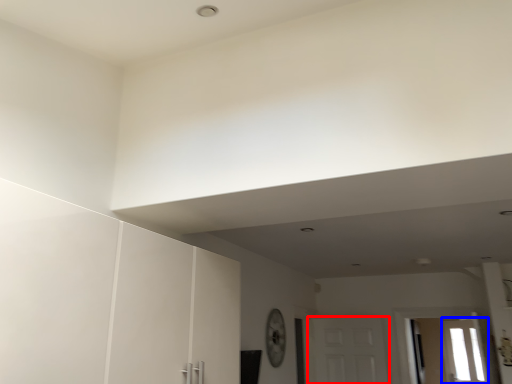
Question: Which object appears farthest to the camera in this image, door (highlighted by a red box) or window (highlighted by a blue box)?

Choices:
 (A) door
 (B) window

Answer: (B)